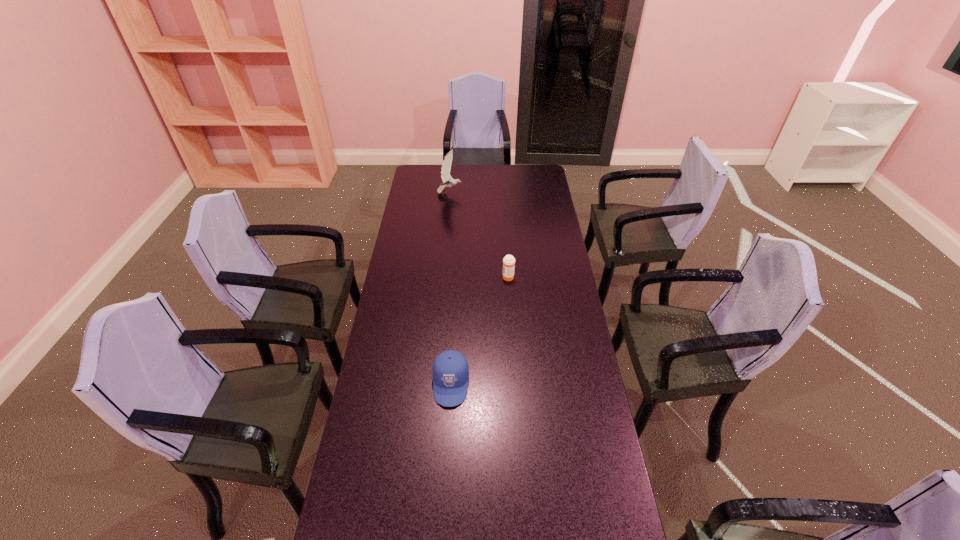
The height and width of the screenshot is (540, 960). Identify the location of the tallest object. (448, 181).

Find the location of a particular element. gull is located at coordinates (448, 181).

Locate an element on the screen. medicine is located at coordinates (508, 261).

The width and height of the screenshot is (960, 540). I want to click on the second farthest object, so click(508, 261).

Find the location of a particular element. The width and height of the screenshot is (960, 540). cap is located at coordinates (450, 369).

I want to click on vacant space located at the tip of the beak of the tallest object, so click(x=487, y=193).

This screenshot has width=960, height=540. In order to click on vacant space located on the back of the medicine in this screenshot , I will do `click(507, 264)`.

Locate an element on the screen. Image resolution: width=960 pixels, height=540 pixels. free space located on the front-facing side of the cap is located at coordinates (444, 497).

In order to click on object present at the far edge in this screenshot , I will do `click(448, 181)`.

The image size is (960, 540). I want to click on object that is at the left edge, so click(x=448, y=181).